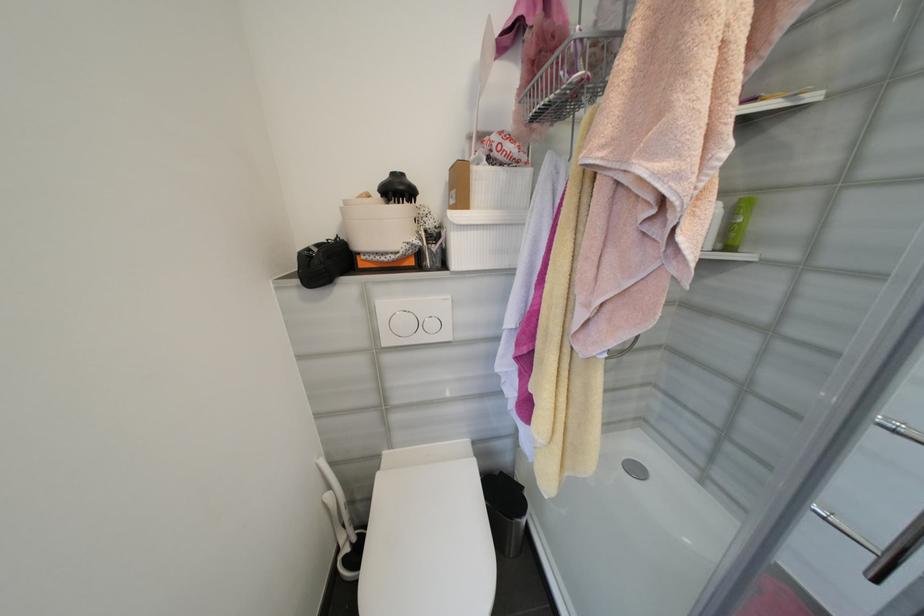
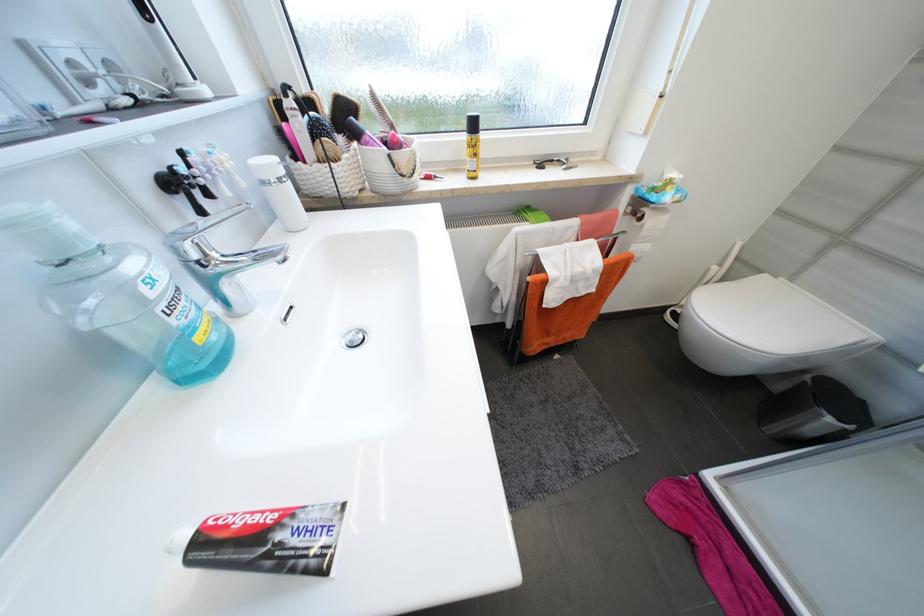
Where in the second image is the point corresponding to point 383,476 from the first image?

(771, 277)